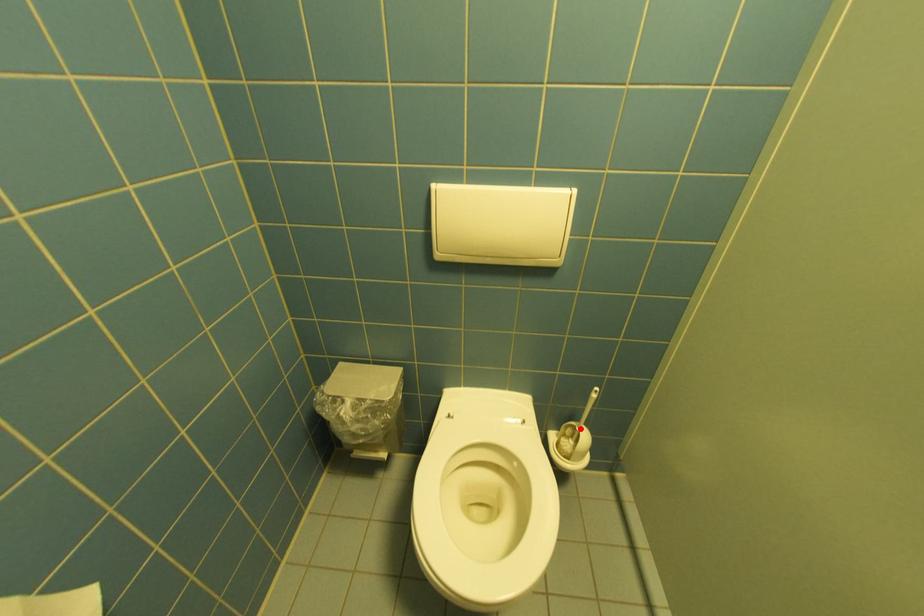
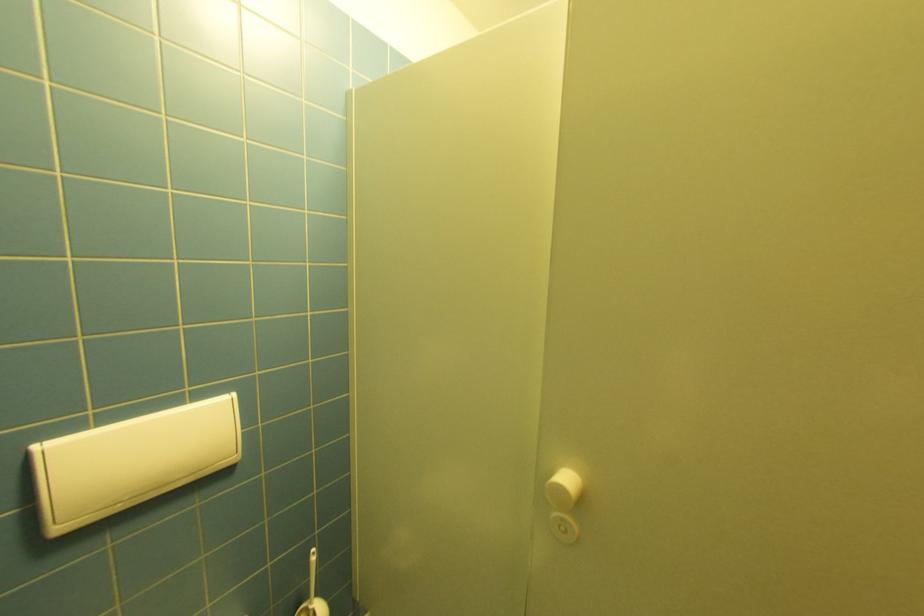
Question: I am providing you with two images of the same scene from different viewpoints. A red point is marked on the first image. At the location where the point appears in image 1, is it still visible in image 2?

Choices:
 (A) Yes
 (B) No

Answer: (A)